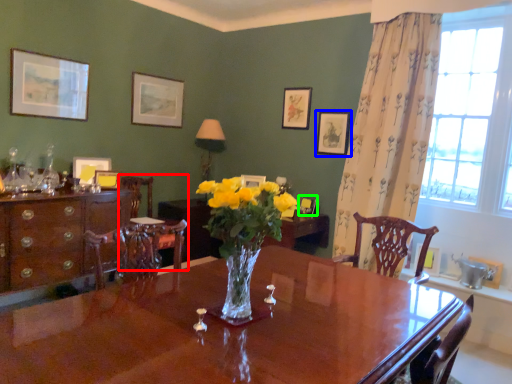
Question: Estimate the real-world distances between objects in this image. Which object is farther from chair (highlighted by a red box), picture frame (highlighted by a blue box) or picture frame (highlighted by a green box)?

Choices:
 (A) picture frame
 (B) picture frame

Answer: (A)